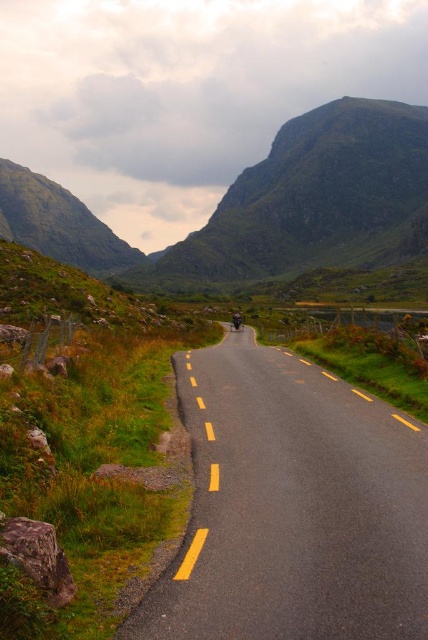
Which of these two, asphalt road at center or green grassy mountain at upper center, stands shorter?

Standing shorter between the two is asphalt road at center.

In the scene shown: Between asphalt road at center and green grassy mountain at upper center, which one is positioned higher?

green grassy mountain at upper center is above.

Find the location of a particular element. This screenshot has width=428, height=640. asphalt road at center is located at coordinates point(291,506).

Identify the location of asphalt road at center. Image resolution: width=428 pixels, height=640 pixels. (291, 506).

How much distance is there between green grassy mountain at upper center and shiny silver motorcycle at center?

198.09 meters

Between green grassy mountain at upper center and shiny silver motorcycle at center, which one has more height?

green grassy mountain at upper center

Is point (363, 189) farther from viewer compared to point (240, 323)?

Yes.

Where is `green grassy mountain at upper center`? The width and height of the screenshot is (428, 640). green grassy mountain at upper center is located at coordinates (264, 205).

Is asphalt road at center shorter than shiny silver motorcycle at center?

Yes.

Does point (362, 396) come behind point (237, 326)?

That is False.

Which is in front, point (309, 384) or point (237, 317)?

Point (309, 384) is in front.

Locate an element on the screen. The image size is (428, 640). asphalt road at center is located at coordinates (291, 506).